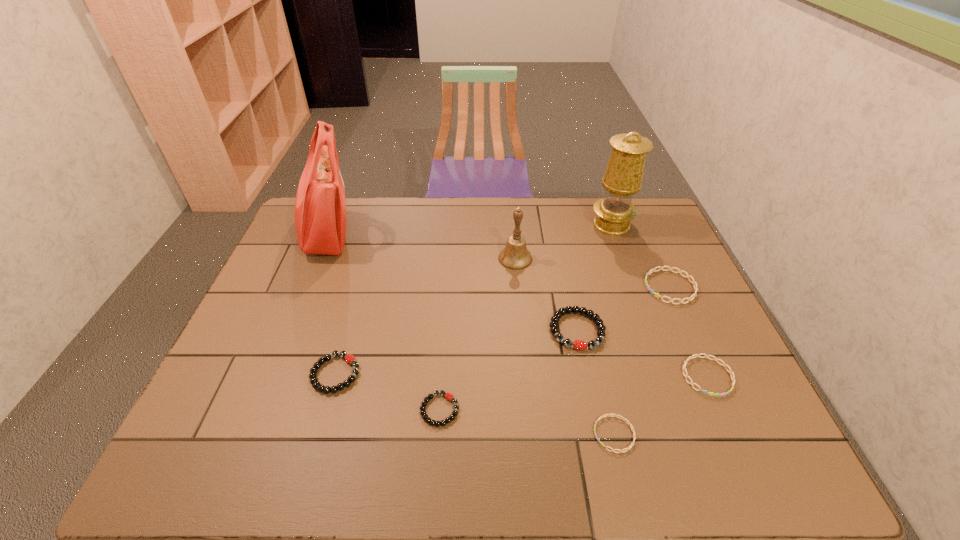
In order to click on vacant region located 0.340m on the surface of the farthest blue bracelet showing star-shaped elements in this screenshot , I will do `click(531, 287)`.

At what (x,y) coordinates should I click in order to perform the action: click on free space located 0.360m on the surface of the farthest blue bracelet showing star-shaped elements. Please return your answer as a coordinate pair (x, y). Looking at the image, I should click on (524, 287).

You are a GUI agent. You are given a task and a screenshot of the screen. Output one action in this format:
    pyautogui.click(x=<x>, y=<y>)
    Task: Click on the free region located on the front of the second smallest black bracelet
    The height and width of the screenshot is (540, 960).
    Given the screenshot: What is the action you would take?
    pyautogui.click(x=310, y=463)

In order to click on vacant space located 0.180m on the surface of the second farthest blue bracelet showing star-shaped elements in this screenshot , I will do `click(751, 475)`.

Image resolution: width=960 pixels, height=540 pixels. In order to click on free space located 0.200m on the left of the seventh object from right to left in this screenshot , I will do `click(333, 410)`.

The image size is (960, 540). I want to click on vacant space situated on the surface of the nearest blue bracelet showing star-shaped elements, so click(x=467, y=434).

The image size is (960, 540). I want to click on blank space located 0.120m on the surface of the nearest blue bracelet showing star-shaped elements, so click(x=540, y=434).

Find the location of a particular element. The width and height of the screenshot is (960, 540). vacant area situated on the surface of the nearest blue bracelet showing star-shaped elements is located at coordinates (535, 434).

This screenshot has width=960, height=540. I want to click on handbag at the far edge, so click(x=320, y=208).

You are a GUI agent. You are given a task and a screenshot of the screen. Output one action in this format:
    pyautogui.click(x=<x>, y=<y>)
    Task: Click on the oil lamp that is positioned at the far edge
    
    Given the screenshot: What is the action you would take?
    click(x=623, y=176)